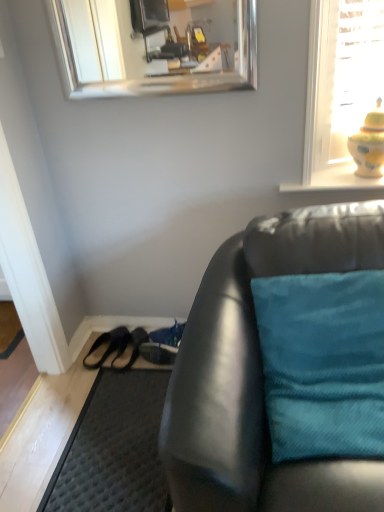
I want to click on free space above dark gray textured doormat at lower left (from a real-world perspective), so click(122, 433).